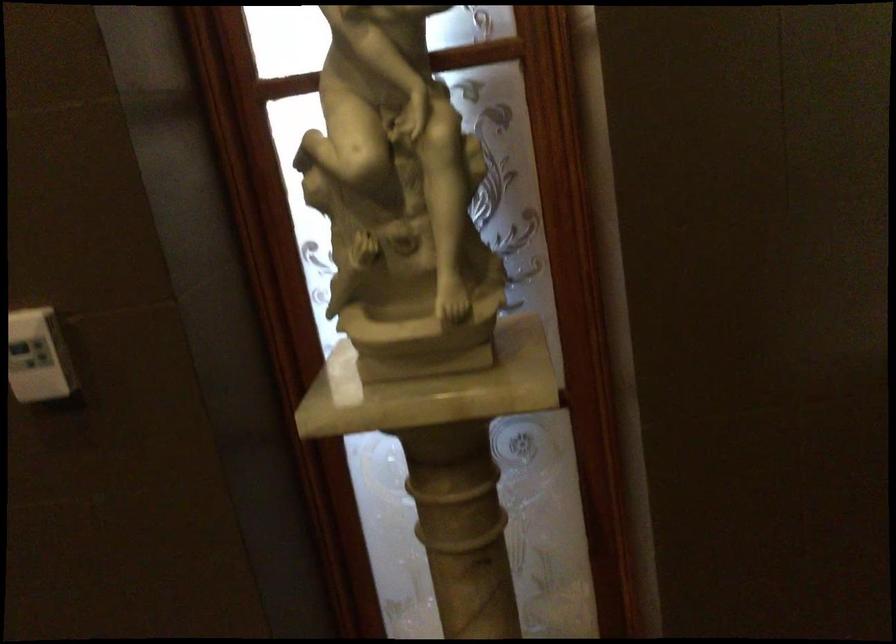
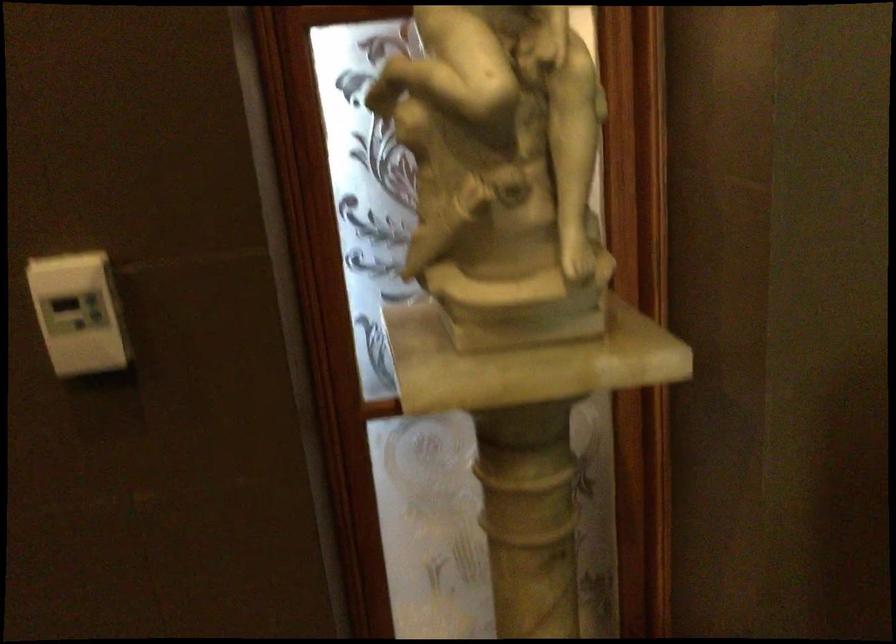
Question: The camera is either moving clockwise (left) or counter-clockwise (right) around the object. The first image is from the beginning of the video and the second image is from the end. Is the camera moving left or right when shooting the video?

Choices:
 (A) Left
 (B) Right

Answer: (A)